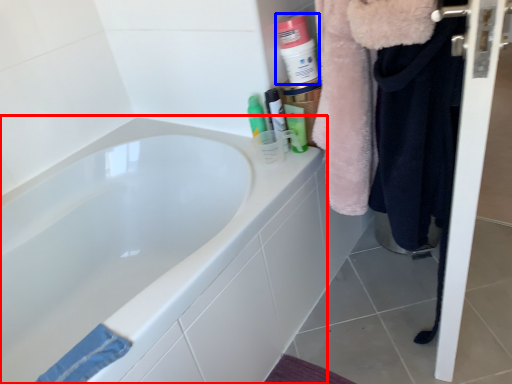
Question: Among these objects, which one is farthest to the camera, bathtub (highlighted by a red box) or cleaning product (highlighted by a blue box)?

Choices:
 (A) bathtub
 (B) cleaning product

Answer: (B)